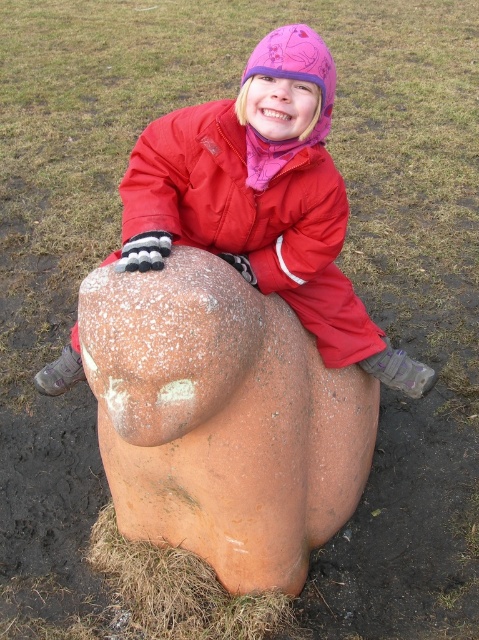
In the scene shown: You are standing at the point with coordinates point (214, 129) and want to walk to the point with coordinates point (167, 246). Based on the image, which direction should you move relative to your current position?

You should move forward because point (167, 246) is in front of point (214, 129).

You are a photographer trying to capture a photo of the child in the red matte jacket at center. To ensure the child is visible, you need to know the height relationship between the child and the rusty stone bear at center. Which object is taller?

The rusty stone bear at center is taller than the red matte jacket at center, so the bear will appear larger in the photo, making the child seem smaller in comparison.